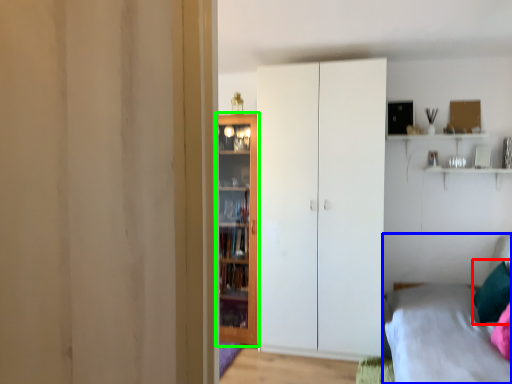
Question: Based on their relative distances, which object is farther from pillow (highlighted by a red box)? Choose from bed (highlighted by a blue box) and door (highlighted by a green box).

Choices:
 (A) bed
 (B) door

Answer: (B)